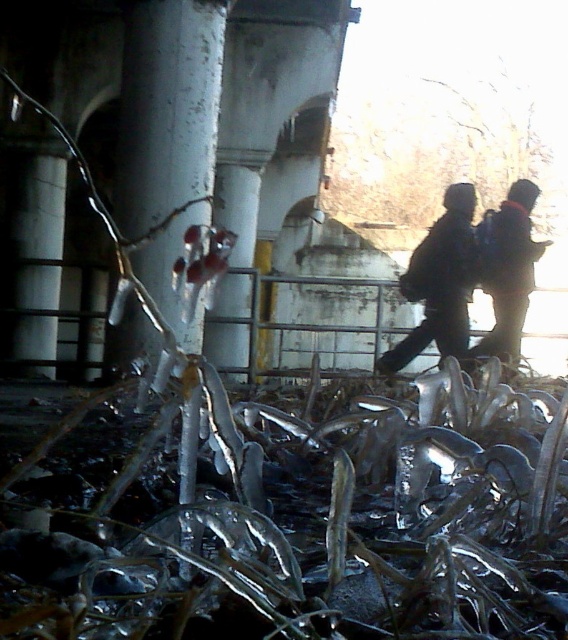
The image size is (568, 640). Describe the element at coordinates (444, 282) in the screenshot. I see `dark brown leather jacket at center` at that location.

Is dark brown leather jacket at center smaller than dark blue jacket at right?

Indeed, dark brown leather jacket at center has a smaller size compared to dark blue jacket at right.

Identify the location of dark brown leather jacket at center. The image size is (568, 640). (444, 282).

Find the location of a particular element. This screenshot has height=640, width=568. dark brown leather jacket at center is located at coordinates (444, 282).

Is transparent ice at lower center thinner than dark blue jacket at right?

In fact, transparent ice at lower center might be wider than dark blue jacket at right.

Does transparent ice at lower center come behind dark blue jacket at right?

No, it is in front of dark blue jacket at right.

Where is `transparent ice at lower center`? The image size is (568, 640). transparent ice at lower center is located at coordinates (294, 518).

Between white matte overpass at center and dark brown leather jacket at center, which one appears on the left side from the viewer's perspective?

white matte overpass at center

Does point (149, 324) lie in front of point (457, 269)?

Yes, point (149, 324) is in front of point (457, 269).

Which is in front, point (135, 148) or point (523, 211)?

Point (135, 148) is in front.

The width and height of the screenshot is (568, 640). In order to click on white matte overpass at center in this screenshot , I will do `click(222, 108)`.